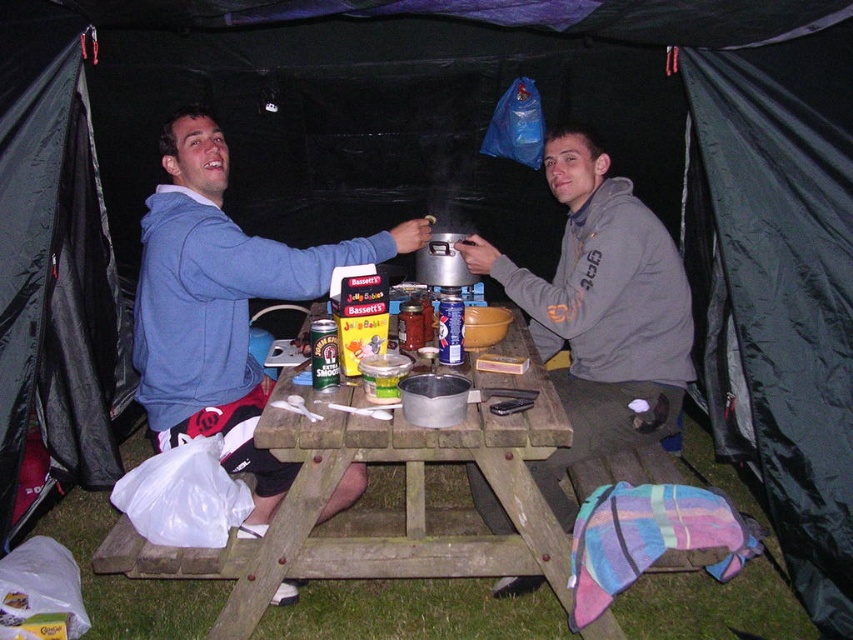
Question: Is blue fleece jacket at upper left thinner than gray fleece hoodie at center?

Choices:
 (A) yes
 (B) no

Answer: (B)

Question: Which is nearer to the blue fleece jacket at upper left?

Choices:
 (A) gray fleece hoodie at center
 (B) black nylon tent at left
 (C) wooden picnic table at center

Answer: (C)

Question: Does blue fleece jacket at upper left appear under wooden picnic table at center?

Choices:
 (A) no
 (B) yes

Answer: (A)

Question: Where is black nylon tent at left located in relation to blue fleece jacket at upper left in the image?

Choices:
 (A) above
 (B) below

Answer: (A)

Question: Which object is the closest to the gray fleece hoodie at center?

Choices:
 (A) blue fleece jacket at upper left
 (B) wooden picnic table at center

Answer: (B)

Question: Which point is farther to the camera?

Choices:
 (A) wooden picnic table at center
 (B) blue fleece jacket at upper left
 (C) black nylon tent at left

Answer: (C)